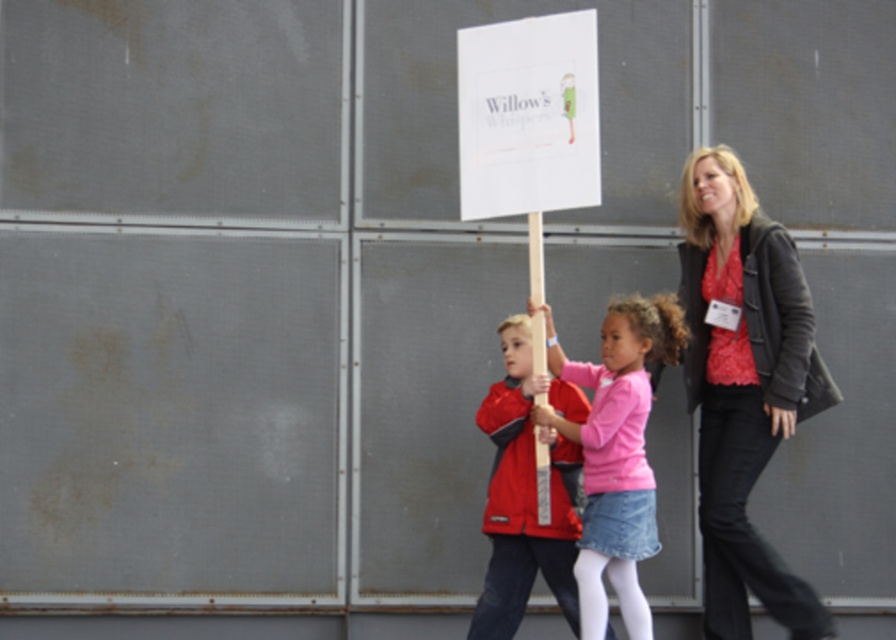
Question: Which of the following is the closest to the observer?

Choices:
 (A) wooden pole at center
 (B) matte red jacket at center
 (C) pink matte shirt at center

Answer: (A)

Question: From the image, what is the correct spatial relationship of matte black jacket at right in relation to matte red jacket at center?

Choices:
 (A) below
 (B) above

Answer: (B)

Question: Can you confirm if matte black jacket at right is thinner than matte red jacket at center?

Choices:
 (A) no
 (B) yes

Answer: (A)

Question: Is matte black jacket at right further to camera compared to white paper sign at center?

Choices:
 (A) no
 (B) yes

Answer: (B)

Question: Which point is farther from the camera taking this photo?

Choices:
 (A) (605, 417)
 (B) (464, 112)
 (C) (528, 259)

Answer: (C)

Question: Considering the real-world distances, which object is closest to the white paper sign at center?

Choices:
 (A) pink matte shirt at center
 (B) wooden pole at center
 (C) matte black jacket at right

Answer: (B)